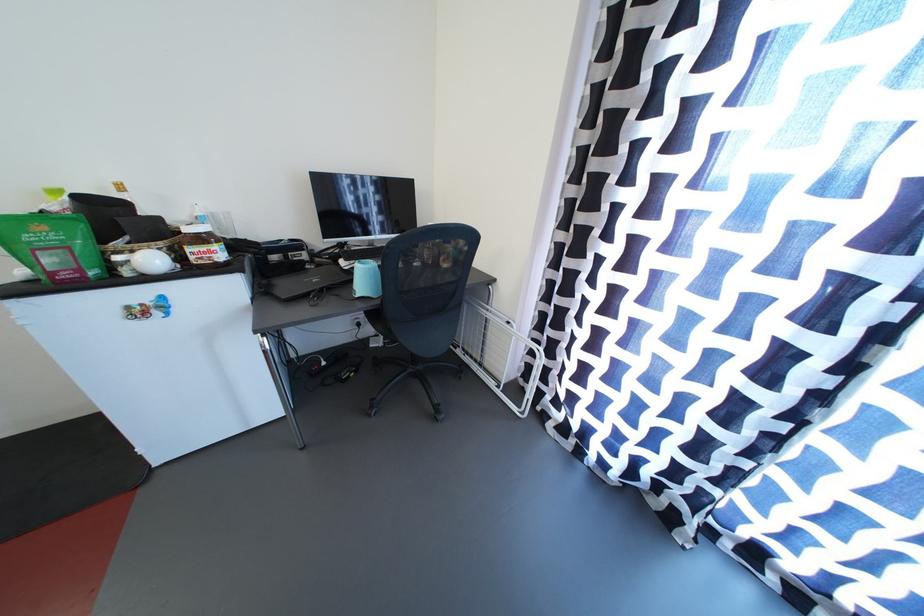
Find the location of `light blue tumbler`. light blue tumbler is located at coordinates (367, 278).